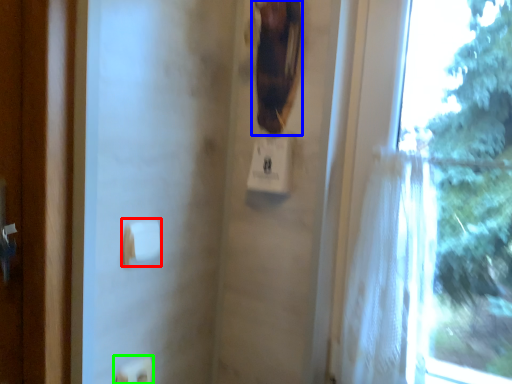
Question: Which object is the closest to the towel bar (highlighted by a red box)? Choose among these: animal (highlighted by a blue box) or light switch (highlighted by a green box).

Choices:
 (A) animal
 (B) light switch

Answer: (B)